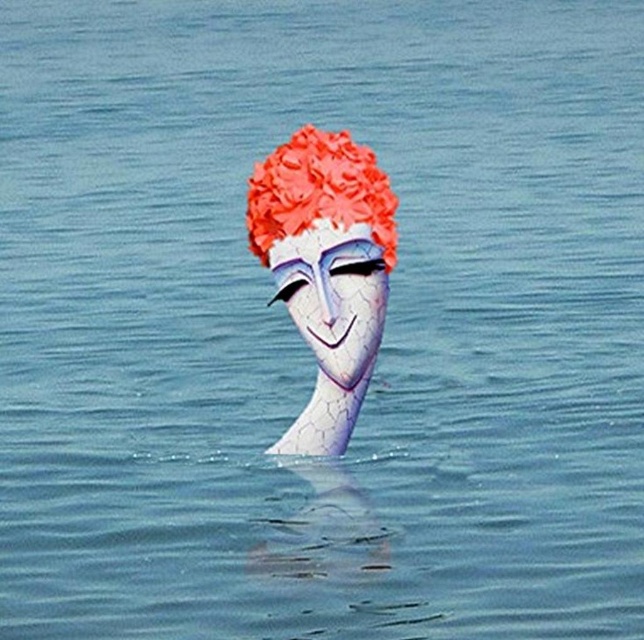
Identify the location of cracked porcelain mask at center. (334, 294).

Measure the distance from cracked porcelain mask at center to shiny orange hair at center.

cracked porcelain mask at center and shiny orange hair at center are 6.71 inches apart.

Between point (305, 240) and point (267, 266), which one is positioned behind?

Point (267, 266)

Find the location of `cracked porcelain mask at center`. cracked porcelain mask at center is located at coordinates pos(334,294).

Is point (323, 257) closer to viewer compared to point (357, 198)?

No, it is behind (357, 198).

Which is behind, point (355, 387) or point (375, 225)?

Point (355, 387)

Between point (350, 336) and point (393, 236), which one is positioned in front?

Point (393, 236) is in front.

Locate an element on the screen. This screenshot has height=640, width=644. cracked porcelain head at center is located at coordinates (327, 268).

Does cracked porcelain head at center have a lesser width compared to cracked porcelain mask at center?

In fact, cracked porcelain head at center might be wider than cracked porcelain mask at center.

Does cracked porcelain head at center have a greater height compared to cracked porcelain mask at center?

Correct, cracked porcelain head at center is much taller as cracked porcelain mask at center.

Describe the element at coordinates (327, 268) in the screenshot. I see `cracked porcelain head at center` at that location.

Identify the location of cracked porcelain head at center. (327, 268).